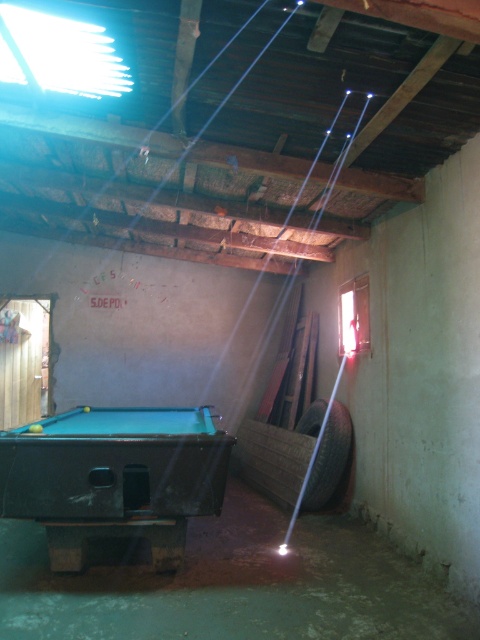
You are standing in the garage and want to place a new rack for pool cues. The rack needs to be placed between the green felt pool table at center and the black rubber tire at lower right. Based on their positions, which object should the rack be closer to?

The rack should be placed closer to the green felt pool table at center because it is positioned on the left side of the black rubber tire at lower right, meaning the distance between them is such that the rack can be placed near the table.

You are organizing a pool tournament and need to ensure there is enough space for participants. Given the green felt pool table at center and the black rubber tire at lower right, which object takes up more space in the room?

The green felt pool table at center is bigger than the black rubber tire at lower right, so it takes up more space in the room.

You are standing in the room and want to place a new decorative item on the green felt pool table at center. However, you notice the black rubber tire at lower right. Is the tire currently on top of the pool table or underneath it?

Result: The green felt pool table at center is positioned over black rubber tire at lower right, meaning the tire is underneath the pool table.